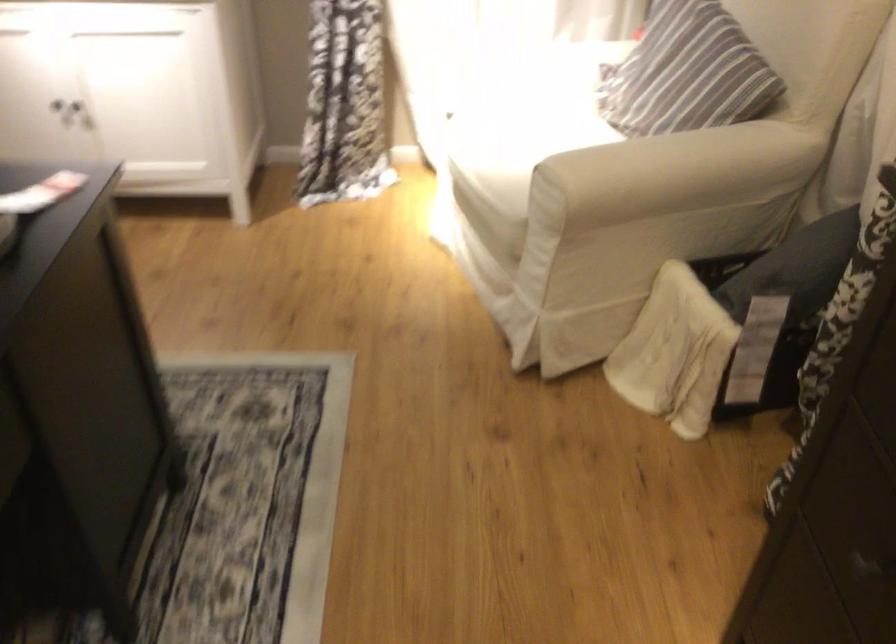
What do you see at coordinates (527, 114) in the screenshot? I see `the chair sitting surface` at bounding box center [527, 114].